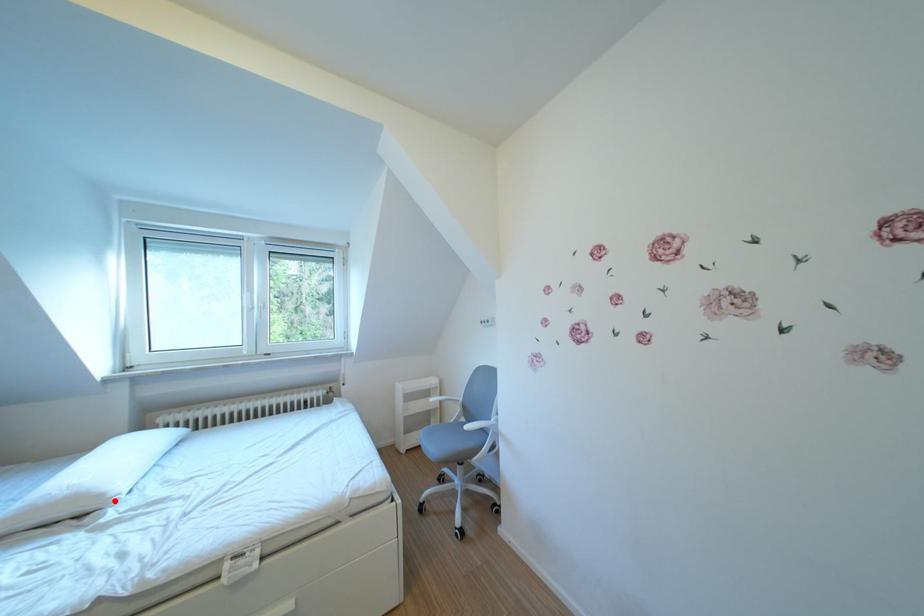
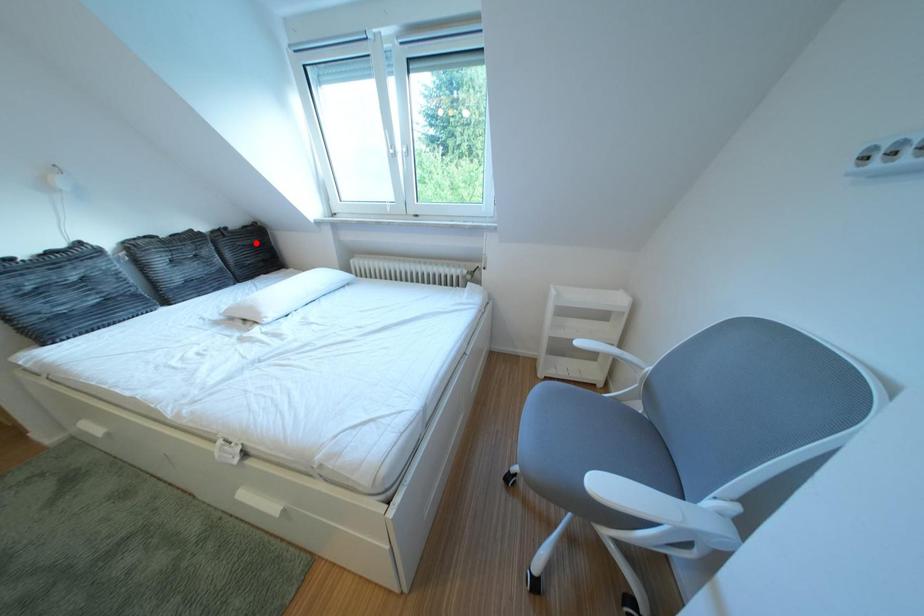
I am providing you with two images of the same scene from different viewpoints. A red point is marked on the first image and another point is marked on the second image. Are the points marked in image1 and image2 representing the same 3D position?

No